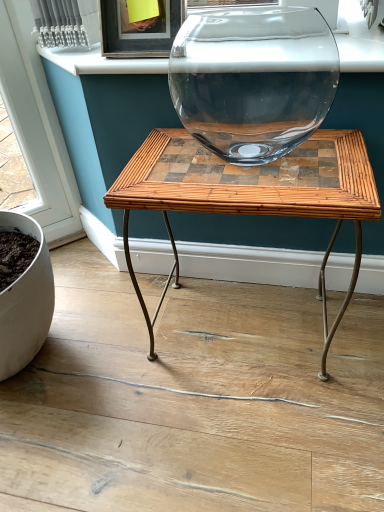
What do you see at coordinates (100, 62) in the screenshot? I see `white glossy window sill at upper center` at bounding box center [100, 62].

Where is `white glossy window sill at upper center`? This screenshot has width=384, height=512. white glossy window sill at upper center is located at coordinates (100, 62).

What do you see at coordinates (251, 194) in the screenshot?
I see `bamboo/rattan table at center` at bounding box center [251, 194].

This screenshot has height=512, width=384. Find the location of `bamboo/rattan table at center`. bamboo/rattan table at center is located at coordinates (251, 194).

You are a GUI agent. You are given a task and a screenshot of the screen. Output one action in this format:
    pyautogui.click(x=<x>, y=<y>)
    Task: Click on the white glossy window sill at upper center
    The width and height of the screenshot is (384, 512).
    Given the screenshot: What is the action you would take?
    pyautogui.click(x=100, y=62)

Looking at this image, considering the positions of objects bamboo/rattan table at center and white glossy window sill at upper center in the image provided, who is more to the right, bamboo/rattan table at center or white glossy window sill at upper center?

bamboo/rattan table at center.

Is bamboo/rattan table at center in front of or behind white glossy window sill at upper center in the image?

Visually, bamboo/rattan table at center is located in front of white glossy window sill at upper center.

Is point (130, 272) positioned after point (339, 51)?

Yes, it is behind point (339, 51).

From the image's perspective, which object appears higher, bamboo/rattan table at center or white glossy window sill at upper center?

white glossy window sill at upper center appears higher in the image.

From a real-world perspective, is bamboo/rattan table at center on white glossy window sill at upper center?

No, from a real-world perspective, bamboo/rattan table at center is not on top of white glossy window sill at upper center.

Is bamboo/rattan table at center thinner than white glossy window sill at upper center?

Incorrect, the width of bamboo/rattan table at center is not less than that of white glossy window sill at upper center.

From their relative heights in the image, would you say bamboo/rattan table at center is taller or shorter than white glossy window sill at upper center?

bamboo/rattan table at center is taller than white glossy window sill at upper center.

Between bamboo/rattan table at center and white glossy window sill at upper center, which one has smaller size?

With smaller size is white glossy window sill at upper center.

Is bamboo/rattan table at center spatially inside white glossy window sill at upper center, or outside of it?

bamboo/rattan table at center exists outside the volume of white glossy window sill at upper center.

Would you consider bamboo/rattan table at center to be distant from white glossy window sill at upper center?

That's not correct — bamboo/rattan table at center is a little close to white glossy window sill at upper center.

Looking at this image, is bamboo/rattan table at center turned away from white glossy window sill at upper center?

bamboo/rattan table at center does not have its back to white glossy window sill at upper center.

How many degrees apart are the facing directions of bamboo/rattan table at center and white glossy window sill at upper center?

The angular difference between bamboo/rattan table at center and white glossy window sill at upper center is 1.1 degrees.

How far apart are bamboo/rattan table at center and white glossy window sill at upper center?

A distance of 13.96 inches exists between bamboo/rattan table at center and white glossy window sill at upper center.

Identify the location of table that appears below the white glossy window sill at upper center (from a real-world perspective). The width and height of the screenshot is (384, 512). (251, 194).

Can you confirm if white glossy window sill at upper center is positioned to the right of bamboo/rattan table at center?

No, white glossy window sill at upper center is not to the right of bamboo/rattan table at center.

Relative to bamboo/rattan table at center, is white glossy window sill at upper center in front or behind?

Visually, white glossy window sill at upper center is located behind bamboo/rattan table at center.

Which is in front, point (376, 48) or point (146, 323)?

The point (376, 48) is in front.

Based on the photo, from the image's perspective, which object appears higher, white glossy window sill at upper center or bamboo/rattan table at center?

From the image's view, white glossy window sill at upper center is above.

From a real-world perspective, is white glossy window sill at upper center below bamboo/rattan table at center?

No, from a real-world perspective, white glossy window sill at upper center is not below bamboo/rattan table at center.

Can you confirm if white glossy window sill at upper center is thinner than bamboo/rattan table at center?

Yes.

In the scene shown: Between white glossy window sill at upper center and bamboo/rattan table at center, which one has less height?

white glossy window sill at upper center is shorter.

Between white glossy window sill at upper center and bamboo/rattan table at center, which one has larger size?

bamboo/rattan table at center is bigger.

Which is correct: white glossy window sill at upper center is inside bamboo/rattan table at center, or outside of it?

white glossy window sill at upper center is not inside bamboo/rattan table at center, it's outside.

Is white glossy window sill at upper center not near bamboo/rattan table at center?

white glossy window sill at upper center is actually quite close to bamboo/rattan table at center.

Could you tell me if white glossy window sill at upper center is facing bamboo/rattan table at center?

No, white glossy window sill at upper center is not aimed at bamboo/rattan table at center.

In order to click on table in front of the white glossy window sill at upper center in this screenshot , I will do `click(251, 194)`.

Locate an element on the screen. The height and width of the screenshot is (512, 384). window sill that is on the left side of bamboo/rattan table at center is located at coordinates (100, 62).

This screenshot has width=384, height=512. I want to click on window sill lying above the bamboo/rattan table at center (from the image's perspective), so click(100, 62).